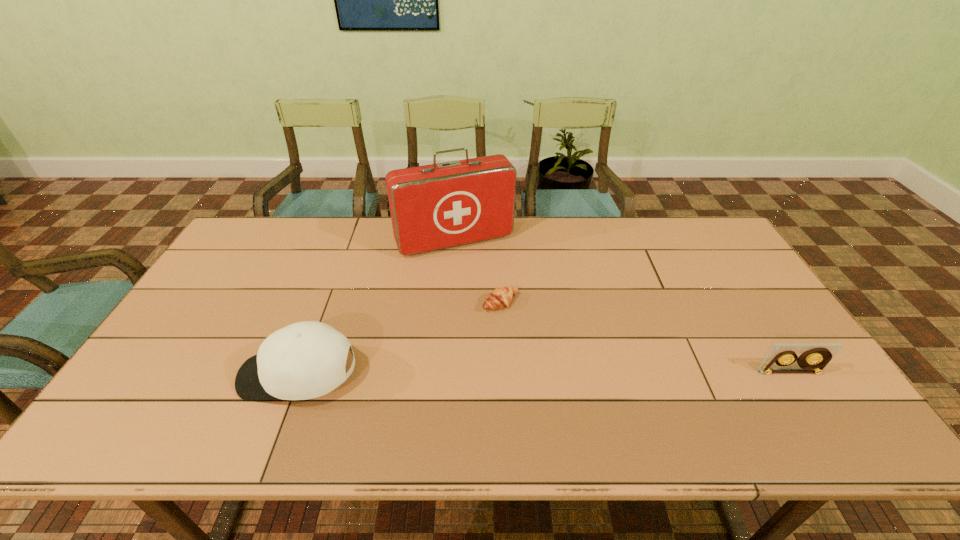
The width and height of the screenshot is (960, 540). Identify the location of object that is positioned at the right edge. (814, 357).

Find the location of `object that is at the near right corner`. object that is at the near right corner is located at coordinates (814, 357).

The width and height of the screenshot is (960, 540). I want to click on free space at the far edge of the desktop, so click(560, 227).

You are a GUI agent. You are given a task and a screenshot of the screen. Output one action in this format:
    pyautogui.click(x=<x>, y=<y>)
    Task: Click on the free location at the near edge
    
    Given the screenshot: What is the action you would take?
    pyautogui.click(x=342, y=397)

In the image, there is a desktop. At what (x,y) coordinates should I click in order to perform the action: click on vacant space at the left edge. Please return your answer as a coordinate pair (x, y). Looking at the image, I should click on (208, 333).

I want to click on free space at the right edge of the desktop, so click(x=742, y=291).

Find the location of `vacant space in between the videotape and the leftmost object`. vacant space in between the videotape and the leftmost object is located at coordinates (544, 374).

This screenshot has height=540, width=960. In order to click on vacant space that's between the tallest object and the rightmost object in this screenshot , I will do (x=622, y=307).

This screenshot has height=540, width=960. I want to click on vacant area between the farthest object and the second shortest object, so click(x=622, y=307).

Identify the location of vacant area that lies between the farthest object and the videotape. The image size is (960, 540). (622, 307).